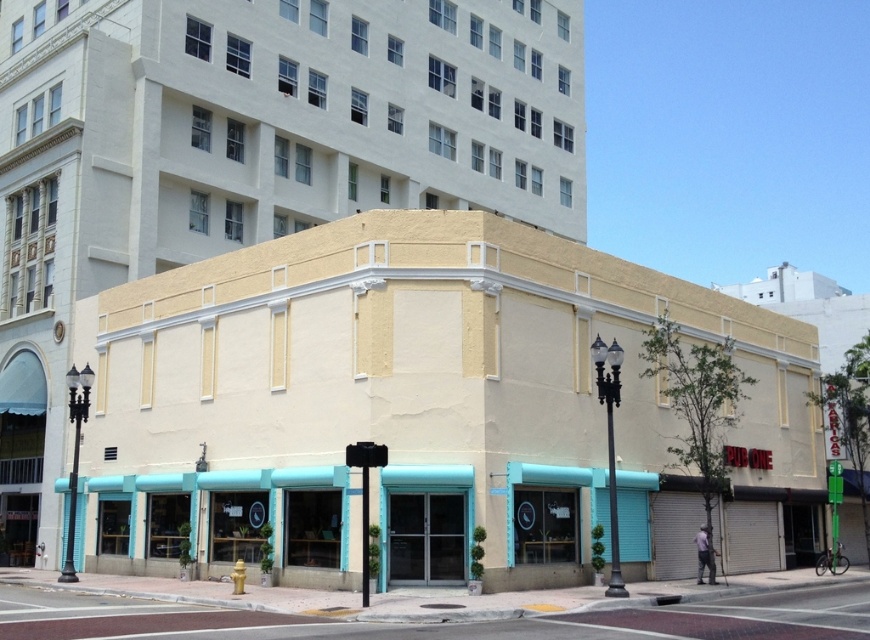
You are standing on the sidewalk in front of the matte yellow building at center. You want to cross the street to reach a coffee shop located 15 meters away from the building. Is the distance between you and the building sufficient to safely cross the street before the traffic light turns red?

The distance between you and the matte yellow building at center is 20.78 meters. Since the coffee shop is only 15 meters away from the building, you are 5.78 meters away from the coffee shop. However, the total distance you need to cross is 20.78 meters to reach the sidewalk opposite the building, which may be too far to cross safely before the traffic light changes. Please ensure you have enough time to cross the street safely.

What is the spatial relationship between the matte yellow building at center and the smooth concrete sidewalk at lower center in the urban scene?

The matte yellow building at center is located to the right of the smooth concrete sidewalk at lower center.

You are a city planner assessing the urban layout. You see the matte yellow building at center and the smooth concrete sidewalk at lower center. Which object occupies a greater vertical space in the image?

The matte yellow building at center is much taller than the smooth concrete sidewalk at lower center, so it occupies more vertical space.